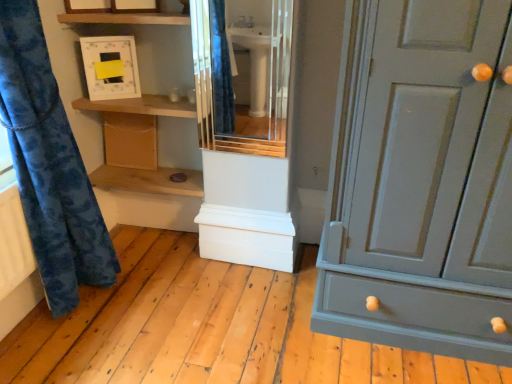
Question: Is wooden shelf at upper center, which is the first shelf in top-to-bottom order, shorter than matte gray cabinet at right?

Choices:
 (A) yes
 (B) no

Answer: (A)

Question: Is wooden shelf at upper center, the 2th shelf ordered from the bottom, far away from matte gray cabinet at right?

Choices:
 (A) no
 (B) yes

Answer: (B)

Question: Can you confirm if wooden shelf at upper center, which is the first shelf in top-to-bottom order, is wider than matte gray cabinet at right?

Choices:
 (A) yes
 (B) no

Answer: (B)

Question: From a real-world perspective, is wooden shelf at upper center, which is the first shelf in top-to-bottom order, on matte gray cabinet at right?

Choices:
 (A) no
 (B) yes

Answer: (B)

Question: From the image's perspective, is wooden shelf at upper center, the 2th shelf ordered from the bottom, below matte gray cabinet at right?

Choices:
 (A) no
 (B) yes

Answer: (A)

Question: Which is correct: blue fabric curtain at left is inside wooden cabinet at lower left, or outside of it?

Choices:
 (A) outside
 (B) inside

Answer: (A)

Question: From a real-world perspective, is blue fabric curtain at left above or below wooden cabinet at lower left?

Choices:
 (A) above
 (B) below

Answer: (A)

Question: Is point (62, 213) closer or farther from the camera than point (150, 153)?

Choices:
 (A) closer
 (B) farther

Answer: (A)

Question: Considering the positions of blue fabric curtain at left and wooden cabinet at lower left in the image, is blue fabric curtain at left bigger or smaller than wooden cabinet at lower left?

Choices:
 (A) small
 (B) big

Answer: (B)

Question: Based on their sizes in the image, would you say matte gray cabinet at right is bigger or smaller than matte white cabinet at center?

Choices:
 (A) big
 (B) small

Answer: (A)

Question: Is matte gray cabinet at right in front of or behind matte white cabinet at center in the image?

Choices:
 (A) front
 (B) behind

Answer: (A)

Question: Considering the positions of matte gray cabinet at right and matte white cabinet at center in the image, is matte gray cabinet at right wider or thinner than matte white cabinet at center?

Choices:
 (A) thin
 (B) wide

Answer: (B)

Question: Considering the positions of point (411, 339) and point (202, 61), is point (411, 339) closer or farther from the camera than point (202, 61)?

Choices:
 (A) farther
 (B) closer

Answer: (B)

Question: Based on their sizes in the image, would you say matte white cabinet at center is bigger or smaller than blue fabric curtain at left?

Choices:
 (A) small
 (B) big

Answer: (A)

Question: From a real-world perspective, is matte white cabinet at center above or below blue fabric curtain at left?

Choices:
 (A) below
 (B) above

Answer: (B)